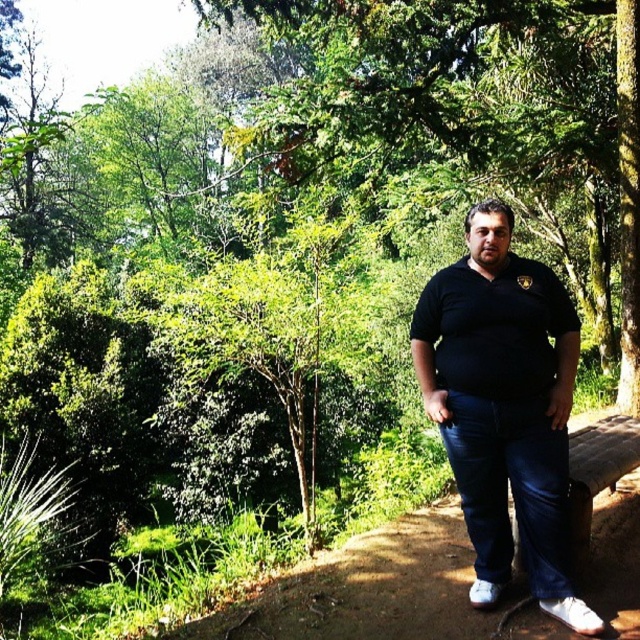
Is black matte shirt at center positioned in front of brown dirt path at center?

Yes.

Locate an element on the screen. black matte shirt at center is located at coordinates pyautogui.click(x=504, y=406).

Who is positioned more to the right, brown dirt path at center or black matte polo shirt at center?

black matte polo shirt at center

Which is behind, point (422, 541) or point (493, 396)?

The point (422, 541) is more distant.

The height and width of the screenshot is (640, 640). In order to click on brown dirt path at center in this screenshot , I will do `click(369, 589)`.

Who is lower down, black matte shirt at center or black matte polo shirt at center?

black matte shirt at center

Does black matte shirt at center have a greater width compared to black matte polo shirt at center?

In fact, black matte shirt at center might be narrower than black matte polo shirt at center.

Is point (436, 372) farther from viewer compared to point (499, 330)?

Yes, point (436, 372) is behind point (499, 330).

You are a GUI agent. You are given a task and a screenshot of the screen. Output one action in this format:
    pyautogui.click(x=<x>, y=<y>)
    Task: Click on the black matte shirt at center
    The height and width of the screenshot is (640, 640).
    Given the screenshot: What is the action you would take?
    pyautogui.click(x=504, y=406)